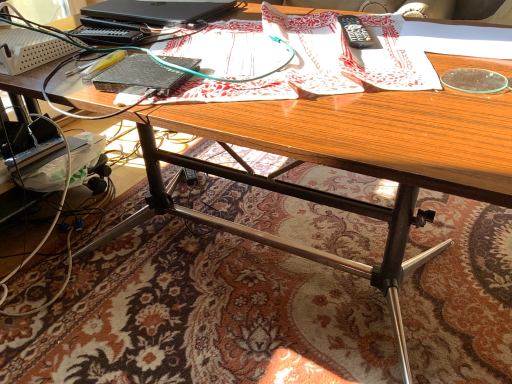
Describe the element at coordinates (155, 12) in the screenshot. The image size is (512, 384). I see `black matte laptop at upper left` at that location.

Where is `black matte laptop at upper left`? black matte laptop at upper left is located at coordinates (155, 12).

Can you confirm if patterned paper at center is shorter than black plastic remote control at upper right?

No.

Is patterned paper at center behind black plastic remote control at upper right?

No, patterned paper at center is closer to the camera.

Is point (158, 51) farther from camera compared to point (358, 45)?

No, it is in front of (358, 45).

Is patterned paper at center turned away from black plastic remote control at upper right?

No, patterned paper at center is not facing the opposite direction of black plastic remote control at upper right.

From a real-world perspective, which object stands above the other?

In real-world perspective, patterned paper at center is above.

Are black plastic remote control at upper right and patterned paper at center making contact?

No, black plastic remote control at upper right is not touching patterned paper at center.

In terms of size, does black plastic remote control at upper right appear bigger or smaller than patterned paper at center?

black plastic remote control at upper right is smaller than patterned paper at center.

Which is behind, black plastic remote control at upper right or patterned paper at center?

black plastic remote control at upper right is further away from the camera.

From the image's perspective, between black matte laptop at upper left and black plastic remote control at upper right, who is located below?

black plastic remote control at upper right appears lower in the image.

From a real-world perspective, is black matte laptop at upper left physically below black plastic remote control at upper right?

No.

Is black matte laptop at upper left to the left or to the right of black plastic remote control at upper right in the image?

Clearly, black matte laptop at upper left is on the left of black plastic remote control at upper right in the image.

Based on the photo, are black matte laptop at upper left and patterned paper at center far apart?

black matte laptop at upper left is near patterned paper at center, not far away.

Would you say black matte laptop at upper left is inside or outside patterned paper at center?

black matte laptop at upper left lies outside patterned paper at center.

Is black matte laptop at upper left looking in the opposite direction of patterned paper at center?

black matte laptop at upper left does not have its back to patterned paper at center.

Does point (370, 58) come farther from viewer compared to point (181, 3)?

No.

Which object is wider, patterned paper at center or black matte laptop at upper left?

With larger width is patterned paper at center.

Based on the photo, is patterned paper at center placed right next to black matte laptop at upper left?

No, patterned paper at center is not making contact with black matte laptop at upper left.

Is patterned paper at center positioned behind black matte laptop at upper left?

No, patterned paper at center is closer to the camera.

Would you say black plastic remote control at upper right is a long distance from black matte laptop at upper left?

They are positioned close to each other.

From a real-world perspective, who is located higher, black plastic remote control at upper right or black matte laptop at upper left?

black matte laptop at upper left, from a real-world perspective.

Is point (365, 46) closer to viewer compared to point (129, 7)?

That is True.

Is black plastic remote control at upper right facing away from black matte laptop at upper left?

No, black plastic remote control at upper right is not facing the opposite direction of black matte laptop at upper left.

At what (x,y) coordinates should I click in order to perform the action: click on wrapping paper above the black plastic remote control at upper right (from a real-world perspective). Please return your answer as a coordinate pair (x, y). Image resolution: width=512 pixels, height=384 pixels. Looking at the image, I should click on (298, 59).

Find the location of a particular element. The height and width of the screenshot is (384, 512). wrapping paper below the black plastic remote control at upper right (from the image's perspective) is located at coordinates (298, 59).

Looking at the image, which one is located further to black matte laptop at upper left, black plastic remote control at upper right or patterned paper at center?

black plastic remote control at upper right lies further to black matte laptop at upper left than the other object.

From the picture: Which object lies further to the anchor point black plastic remote control at upper right, black matte laptop at upper left or patterned paper at center?

black matte laptop at upper left.

Estimate the real-world distances between objects in this image. Which object is closer to patterned paper at center, black plastic remote control at upper right or black matte laptop at upper left?

black plastic remote control at upper right lies closer to patterned paper at center than the other object.

Based on their spatial positions, is patterned paper at center or black plastic remote control at upper right closer to black matte laptop at upper left?

The object closer to black matte laptop at upper left is patterned paper at center.

Looking at the image, which one is located closer to black plastic remote control at upper right, patterned paper at center or black matte laptop at upper left?

Based on the image, patterned paper at center appears to be nearer to black plastic remote control at upper right.

Which object lies further to the anchor point patterned paper at center, black matte laptop at upper left or black plastic remote control at upper right?

The object further to patterned paper at center is black matte laptop at upper left.

Locate an element on the screen. Image resolution: width=512 pixels, height=384 pixels. wrapping paper located between black matte laptop at upper left and black plastic remote control at upper right in the left-right direction is located at coordinates (298, 59).